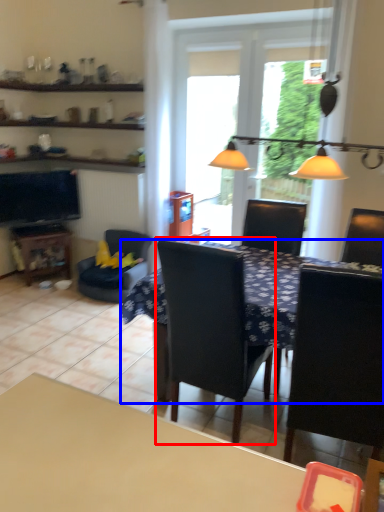
Question: Which object is closer to the camera taking this photo, chair (highlighted by a red box) or table (highlighted by a blue box)?

Choices:
 (A) chair
 (B) table

Answer: (B)